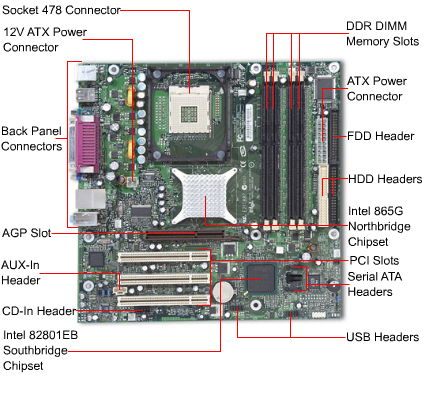
The width and height of the screenshot is (430, 400). What are the coordinates of `socket connector` in the screenshot? It's located at (191, 104).